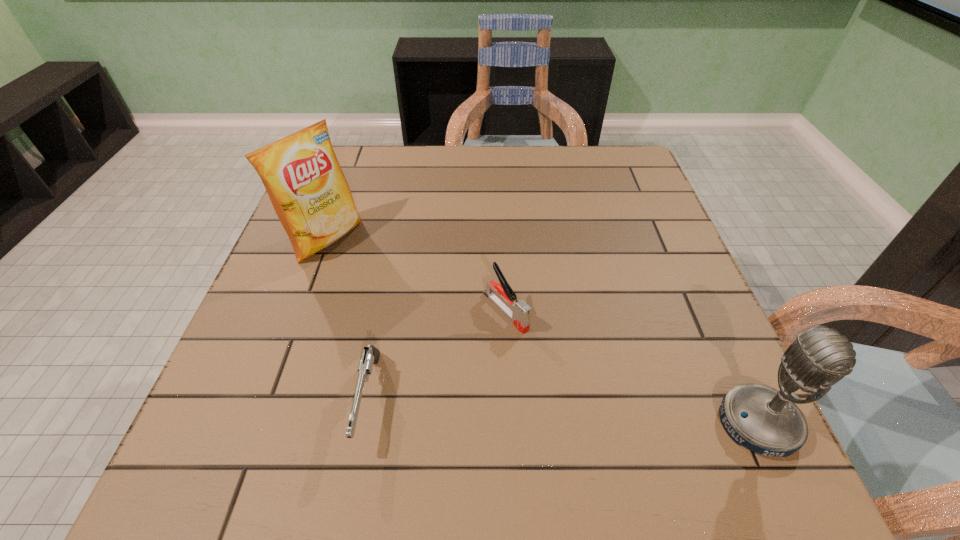
Image resolution: width=960 pixels, height=540 pixels. Find the location of `free region that satisfies the following two spatial constraints: 1. on the front-facing side of the pistol; 2. on the front-facing side of the microphone`. free region that satisfies the following two spatial constraints: 1. on the front-facing side of the pistol; 2. on the front-facing side of the microphone is located at coordinates (364, 424).

Image resolution: width=960 pixels, height=540 pixels. What are the coordinates of `vacant space that satisfies the following two spatial constraints: 1. on the front side of the third tallest object; 2. on the left side of the farthest object` in the screenshot? It's located at (300, 311).

At what (x,y) coordinates should I click in order to perform the action: click on free spot that satisfies the following two spatial constraints: 1. on the front side of the rightmost object; 2. on the front-facing side of the leftmost object. Please return your answer as a coordinate pair (x, y). Looking at the image, I should click on (259, 424).

I want to click on free region that satisfies the following two spatial constraints: 1. on the front-facing side of the pistol; 2. on the front-facing side of the rightmost object, so click(364, 424).